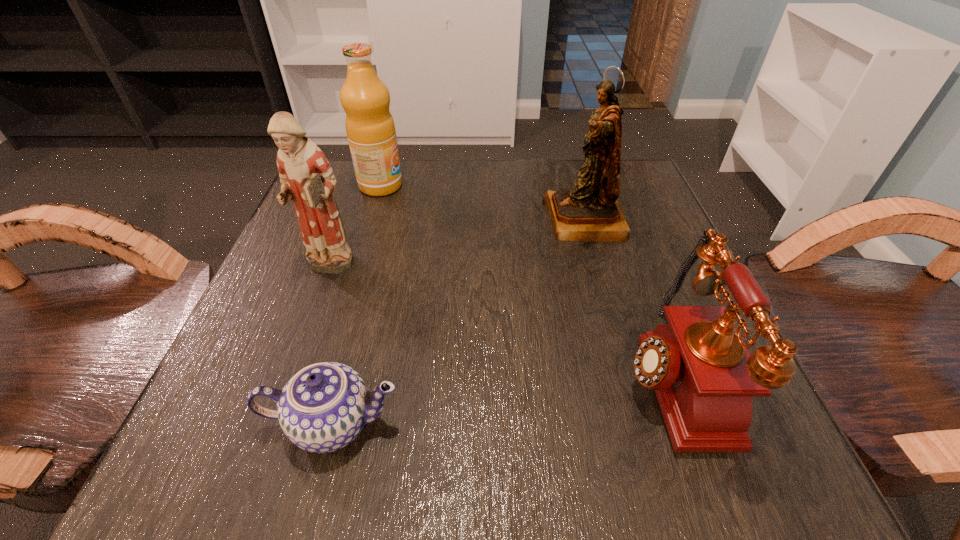
Locate an element on the screen. Image resolution: width=960 pixels, height=540 pixels. vacant point located on the front-facing side of the left figurine is located at coordinates (306, 327).

Locate an element on the screen. vacant space located 0.080m on the dial of the telephone is located at coordinates (566, 377).

Where is `free point located on the dial of the telephone`? The height and width of the screenshot is (540, 960). free point located on the dial of the telephone is located at coordinates (453, 377).

This screenshot has height=540, width=960. What are the coordinates of `free space located 0.070m on the dial of the telephone` in the screenshot? It's located at (573, 377).

Locate an element on the screen. figurine present at the far edge is located at coordinates (590, 212).

The width and height of the screenshot is (960, 540). Find the location of `fruit juice at the far edge`. fruit juice at the far edge is located at coordinates (370, 128).

Identify the location of telephone located at the near edge. This screenshot has height=540, width=960. [x=704, y=377].

Find the location of `chinaware at the near edge`. chinaware at the near edge is located at coordinates (322, 408).

Where is `fruit juice that is positioned at the left edge`? This screenshot has height=540, width=960. fruit juice that is positioned at the left edge is located at coordinates (370, 128).

Find the location of a particular element. This screenshot has height=540, width=960. figurine that is at the left edge is located at coordinates (307, 178).